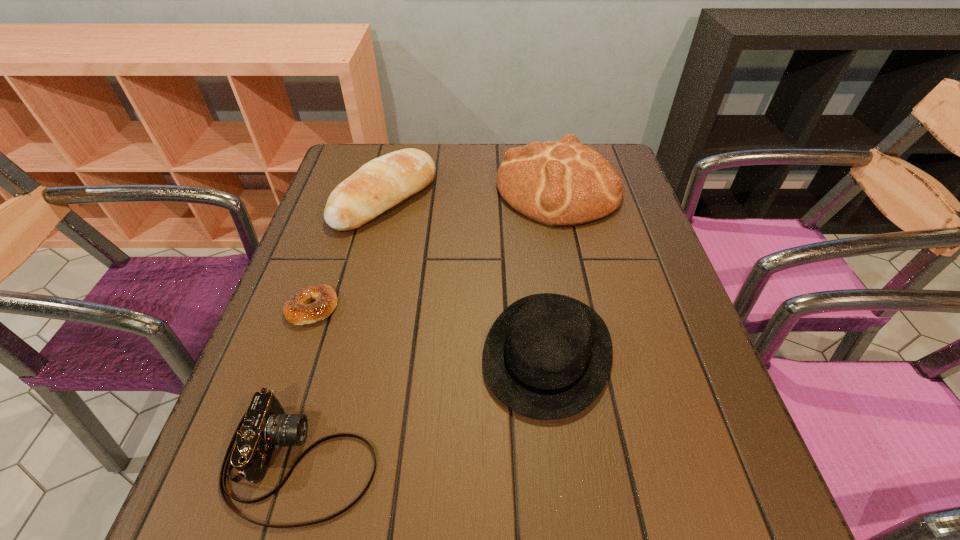
This screenshot has height=540, width=960. Identify the location of the right bread. (563, 183).

Locate an element on the screen. Image resolution: width=960 pixels, height=540 pixels. the shorter bread is located at coordinates (382, 183).

Locate an element on the screen. The width and height of the screenshot is (960, 540). the left bread is located at coordinates (382, 183).

The height and width of the screenshot is (540, 960). I want to click on the third tallest object, so click(548, 356).

At what (x,y) coordinates should I click in order to perform the action: click on camera. Please return your answer as a coordinate pair (x, y). This screenshot has height=540, width=960. Looking at the image, I should click on (264, 426).

Locate an element on the screen. Image resolution: width=960 pixels, height=540 pixels. the shortest object is located at coordinates (296, 309).

What are the coordinates of `free space located 0.370m on the left of the right bread` in the screenshot? It's located at (356, 188).

Identify the location of vacant space positioned on the right of the left bread. Image resolution: width=960 pixels, height=540 pixels. (454, 199).

Locate an element on the screen. This screenshot has width=960, height=540. vacant position located 0.060m on the right of the fedora is located at coordinates (645, 353).

The width and height of the screenshot is (960, 540). What are the coordinates of `blank space located 0.240m on the front-facing side of the camera` in the screenshot? It's located at (536, 460).